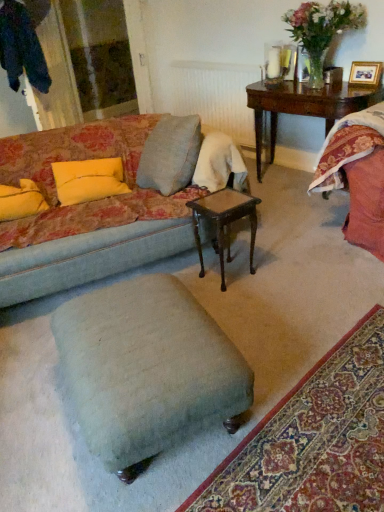
Question: Is yellow fabric pillow at left, arranged as the 2th pillow when viewed from the left, at the back of velvet teal ottoman at lower center?

Choices:
 (A) no
 (B) yes

Answer: (A)

Question: Is velvet teal ottoman at lower center shorter than yellow fabric pillow at left, which is counted as the first pillow, starting from the right?

Choices:
 (A) no
 (B) yes

Answer: (B)

Question: Is yellow fabric pillow at left, which is counted as the first pillow, starting from the right, located within velvet teal ottoman at lower center?

Choices:
 (A) yes
 (B) no

Answer: (B)

Question: Does velvet teal ottoman at lower center have a lesser width compared to yellow fabric pillow at left, arranged as the 2th pillow when viewed from the left?

Choices:
 (A) no
 (B) yes

Answer: (A)

Question: From a real-world perspective, is velvet teal ottoman at lower center over yellow fabric pillow at left, arranged as the 2th pillow when viewed from the left?

Choices:
 (A) no
 (B) yes

Answer: (A)

Question: In terms of width, does wooden stained table at center look wider or thinner when compared to yellow fabric pillow at left, which is the first pillow in left-to-right order?

Choices:
 (A) thin
 (B) wide

Answer: (A)

Question: Considering the positions of point (246, 194) and point (24, 211), is point (246, 194) closer or farther from the camera than point (24, 211)?

Choices:
 (A) closer
 (B) farther

Answer: (A)

Question: Considering their positions, is wooden stained table at center located in front of or behind yellow fabric pillow at left, placed as the 2th pillow when sorted from right to left?

Choices:
 (A) front
 (B) behind

Answer: (A)

Question: In terms of height, does wooden stained table at center look taller or shorter compared to yellow fabric pillow at left, placed as the 2th pillow when sorted from right to left?

Choices:
 (A) tall
 (B) short

Answer: (A)

Question: Is yellow fabric pillow at left, which is counted as the first pillow, starting from the right, bigger or smaller than light blue fabric stool at center?

Choices:
 (A) small
 (B) big

Answer: (A)

Question: From a real-world perspective, is yellow fabric pillow at left, arranged as the 2th pillow when viewed from the left, above or below light blue fabric stool at center?

Choices:
 (A) below
 (B) above

Answer: (B)

Question: Considering their positions, is yellow fabric pillow at left, which is counted as the first pillow, starting from the right, located in front of or behind light blue fabric stool at center?

Choices:
 (A) front
 (B) behind

Answer: (B)

Question: Does point (82, 160) appear closer or farther from the camera than point (150, 296)?

Choices:
 (A) closer
 (B) farther

Answer: (B)

Question: From a real-world perspective, is white textured radiator at upper center physically located above or below wooden picture frame at upper right?

Choices:
 (A) below
 (B) above

Answer: (A)

Question: Considering their positions, is white textured radiator at upper center located in front of or behind wooden picture frame at upper right?

Choices:
 (A) behind
 (B) front

Answer: (A)